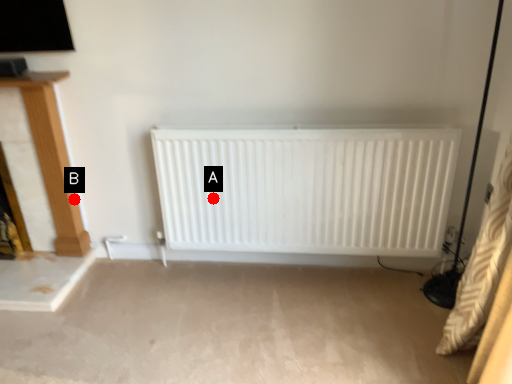
Question: Two points are circled on the image, labeled by A and B beside each circle. Which point appears closest to the camera in this image?

Choices:
 (A) A is closer
 (B) B is closer

Answer: (A)